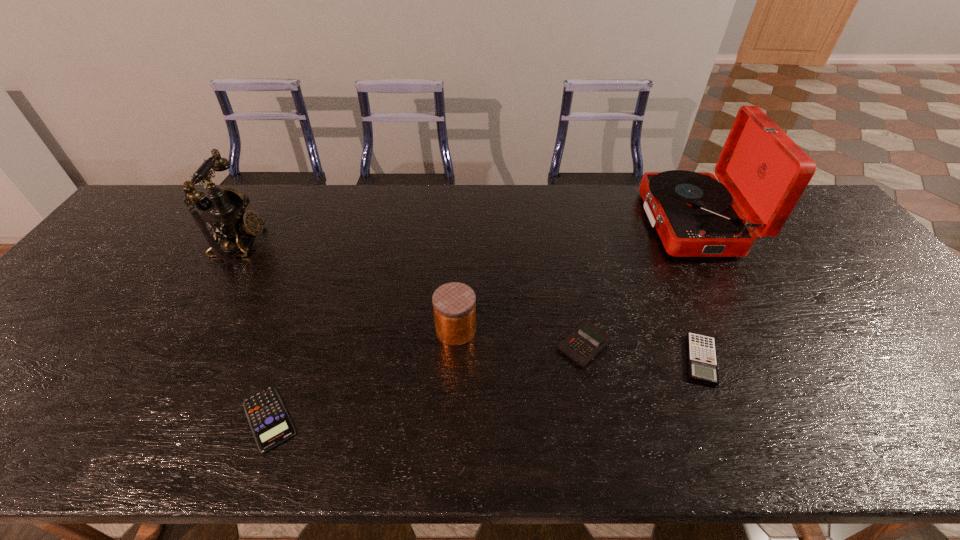
The width and height of the screenshot is (960, 540). What are the coordinates of `vacant area that lies between the fifth object from right to left and the rightmost calculator` in the screenshot? It's located at (485, 389).

At what (x,y) coordinates should I click in order to perform the action: click on blank region between the second calculator from right to left and the fourth object from right to left. Please return your answer as a coordinate pair (x, y). This screenshot has height=540, width=960. Looking at the image, I should click on (519, 337).

I want to click on vacant space that is in between the leftmost object and the phonograph_record, so click(x=467, y=233).

The width and height of the screenshot is (960, 540). Identify the location of empty location between the third shortest object and the third tallest object. (519, 337).

This screenshot has height=540, width=960. I want to click on free space between the phonograph_record and the second calculator from right to left, so click(637, 284).

The height and width of the screenshot is (540, 960). Identify the location of empty space between the fifth shortest object and the tallest calculator. (412, 294).

Locate an element on the screen. The width and height of the screenshot is (960, 540). object that stands as the fourth closest to the shortest calculator is located at coordinates (702, 360).

Locate an element on the screen. Image resolution: width=960 pixels, height=540 pixels. object that is the second closest one to the tallest object is located at coordinates (586, 341).

Locate an element on the screen. calculator that is the second nearest to the fifth tallest object is located at coordinates (270, 423).

Where is `calculator that is the closest to the shortest object`? calculator that is the closest to the shortest object is located at coordinates (586, 341).